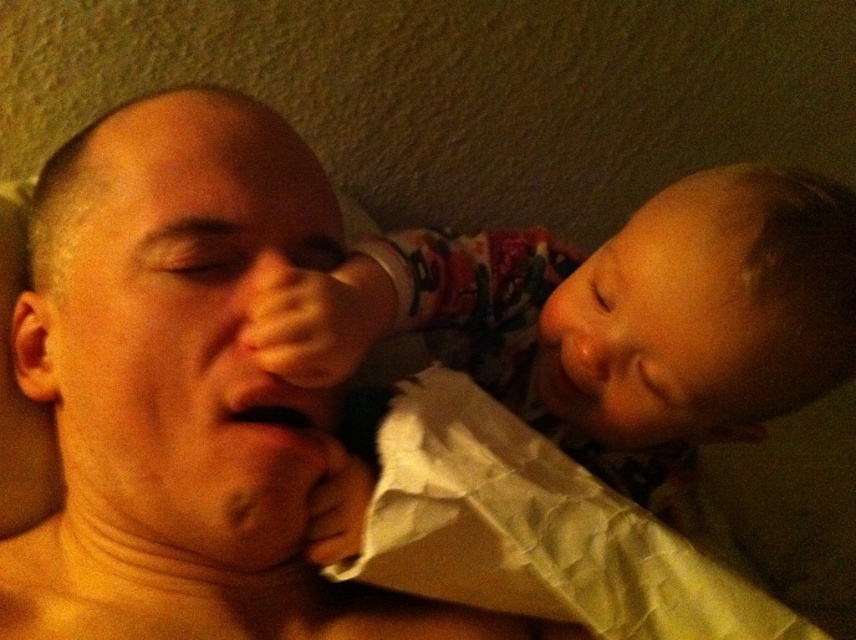
Does skinny white shirt at center appear on the left side of soft pink fabric at upper right?

Indeed, skinny white shirt at center is positioned on the left side of soft pink fabric at upper right.

Between point (236, 208) and point (467, 305), which one is positioned behind?

Positioned behind is point (467, 305).

What do you see at coordinates (183, 392) in the screenshot?
I see `skinny white shirt at center` at bounding box center [183, 392].

This screenshot has height=640, width=856. I want to click on skinny white shirt at center, so click(x=183, y=392).

Who is lower down, soft pink fabric at upper right or white crumpled paper at lower center?

white crumpled paper at lower center

Is point (739, 168) less distant than point (437, 472)?

No, (739, 168) is behind (437, 472).

I want to click on soft pink fabric at upper right, so click(605, 316).

Between point (187, 216) and point (580, 480), which one is positioned in front?

Point (187, 216) is in front.

Does skinny white shirt at center appear on the left side of white crumpled paper at lower center?

Correct, you'll find skinny white shirt at center to the left of white crumpled paper at lower center.

Does point (242, 275) lie behind point (396, 509)?

Yes, it is behind point (396, 509).

Image resolution: width=856 pixels, height=640 pixels. I want to click on skinny white shirt at center, so click(x=183, y=392).